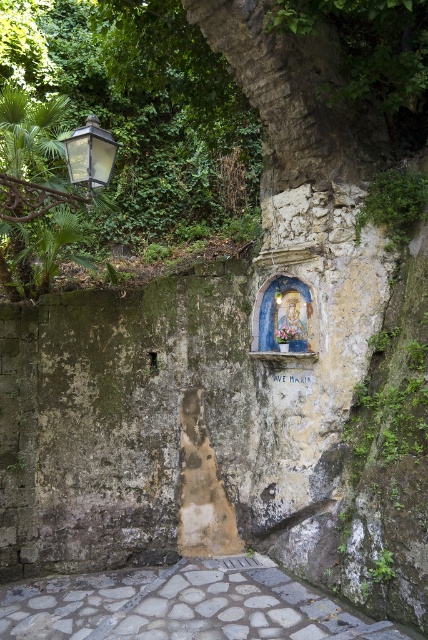
You are standing in front of the stone wall with the niche and the street lamp. There are two points marked on the wall at coordinates point (380, 220) and point (95, 141). Which point is closer to you?

Point (380, 220) is further to the viewer than point (95, 141), so the point closer to you is point (95, 141).

You are standing at the entrance of the rustic outdoor setting and want to walk towards the gray stone path at center. According to the coordinates provided, is the path closer to the top or bottom of the image?

The gray stone path at center is located at point (184, 605), which means it is closer to the bottom of the image since the y coordinate is 0.430. In image coordinates, lower y values are closer to the bottom.